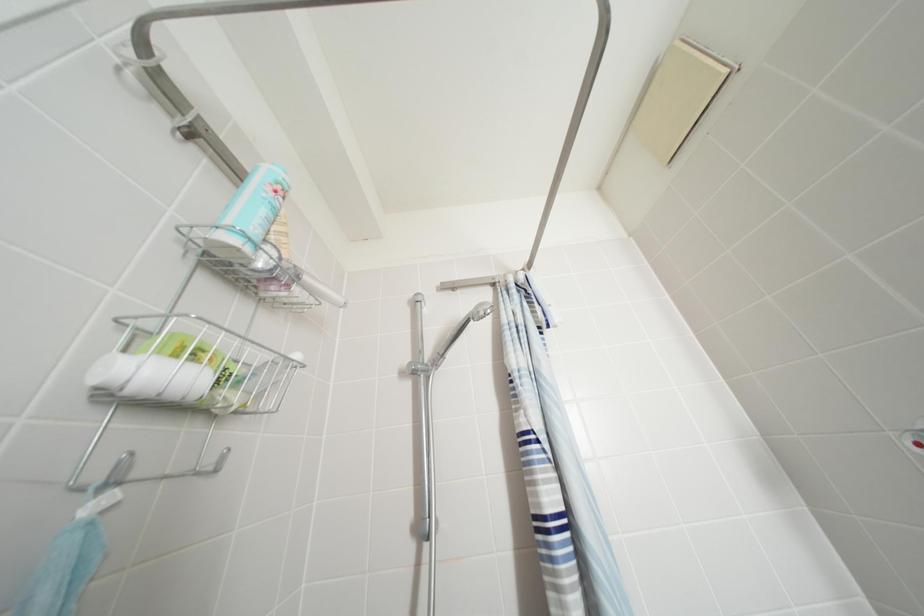
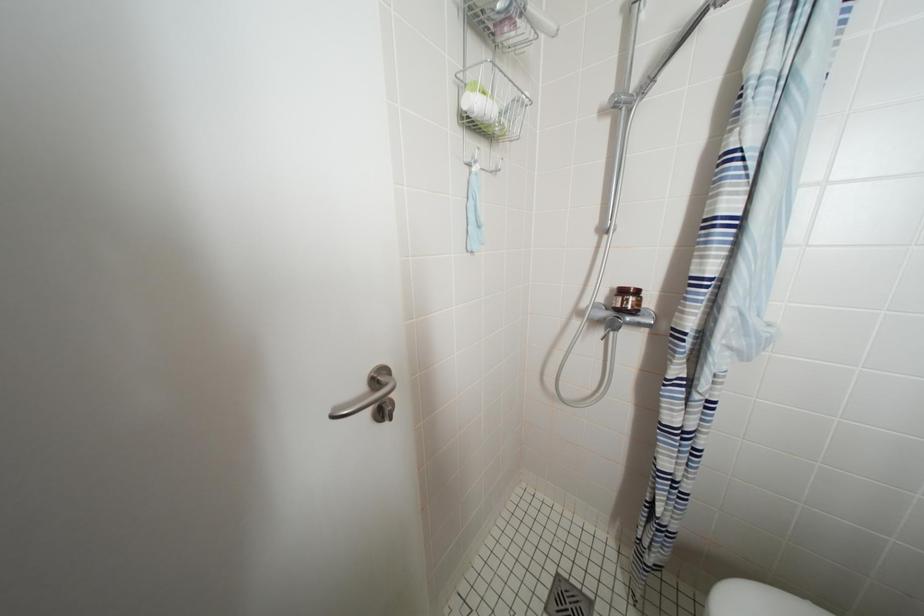
First-person continuous shooting, in which direction is the camera rotating?

The camera rotated toward left-down.